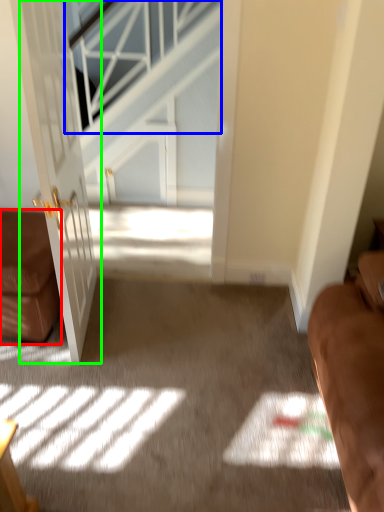
Question: Which is farther away from furniture (highlighted by a red box)? window (highlighted by a blue box) or door (highlighted by a green box)?

Choices:
 (A) window
 (B) door

Answer: (A)